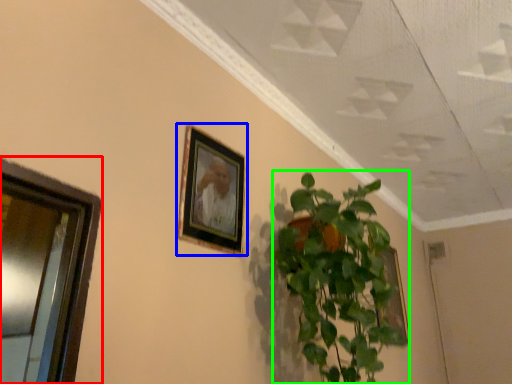
Question: Estimate the real-world distances between objects in this image. Which object is farther from window (highlighted by a red box), picture frame (highlighted by a blue box) or houseplant (highlighted by a green box)?

Choices:
 (A) picture frame
 (B) houseplant

Answer: (B)